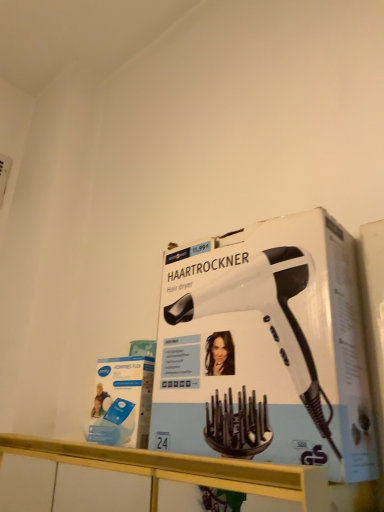
Question: Can you confirm if white matte hair dryer at center is thinner than white glossy counter at lower center?

Choices:
 (A) no
 (B) yes

Answer: (B)

Question: From a real-world perspective, is white matte hair dryer at center on top of white glossy counter at lower center?

Choices:
 (A) yes
 (B) no

Answer: (A)

Question: Is the depth of white matte hair dryer at center greater than that of white glossy counter at lower center?

Choices:
 (A) yes
 (B) no

Answer: (A)

Question: Is white matte hair dryer at center taller than white glossy counter at lower center?

Choices:
 (A) yes
 (B) no

Answer: (A)

Question: Is white matte hair dryer at center at the left side of white glossy counter at lower center?

Choices:
 (A) no
 (B) yes

Answer: (A)

Question: Is there a large distance between white matte hair dryer at center and white glossy counter at lower center?

Choices:
 (A) no
 (B) yes

Answer: (A)

Question: Is white glossy counter at lower center at the right side of white matte hair dryer at center?

Choices:
 (A) no
 (B) yes

Answer: (A)

Question: Could you tell me if white glossy counter at lower center is turned towards white matte hair dryer at center?

Choices:
 (A) yes
 (B) no

Answer: (B)

Question: Can you confirm if white glossy counter at lower center is bigger than white matte hair dryer at center?

Choices:
 (A) yes
 (B) no

Answer: (A)

Question: Is white glossy counter at lower center closer to camera compared to white matte hair dryer at center?

Choices:
 (A) no
 (B) yes

Answer: (B)

Question: Is white glossy counter at lower center looking in the opposite direction of white matte hair dryer at center?

Choices:
 (A) yes
 (B) no

Answer: (B)

Question: From a real-world perspective, is white glossy counter at lower center below white matte hair dryer at center?

Choices:
 (A) yes
 (B) no

Answer: (A)

Question: From their relative heights in the image, would you say white glossy counter at lower center is taller or shorter than white matte hair dryer at center?

Choices:
 (A) short
 (B) tall

Answer: (A)